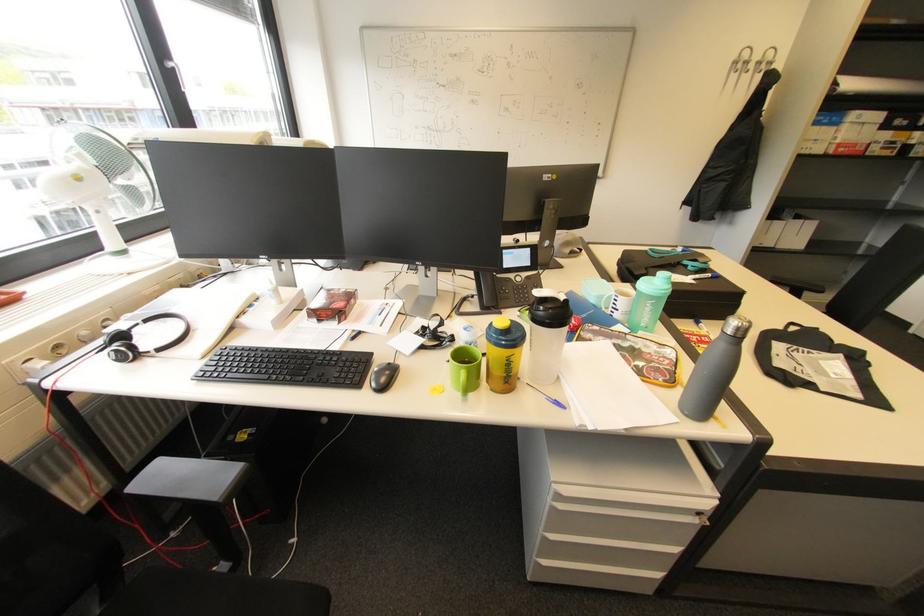
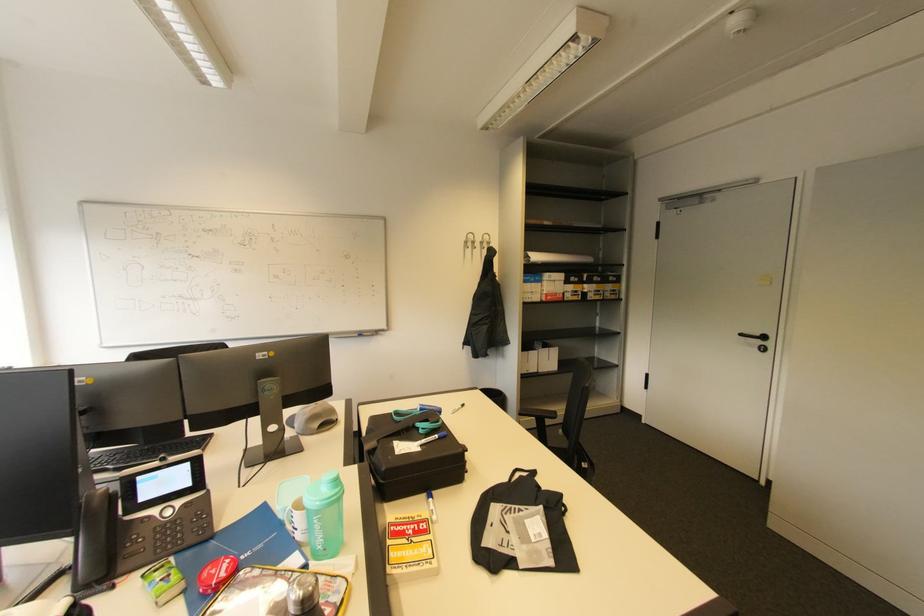
Find the pixel in the second image that matches pixel 652 305 in the first image.

(320, 522)